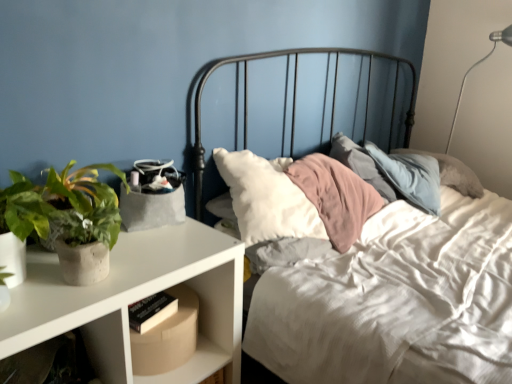
You are a GUI agent. You are given a task and a screenshot of the screen. Output one action in this format:
    pyautogui.click(x=<x>, y=<y>)
    Task: Click on the vacant point to the right of green matte plant at left
    
    Given the screenshot: What is the action you would take?
    pyautogui.click(x=170, y=250)